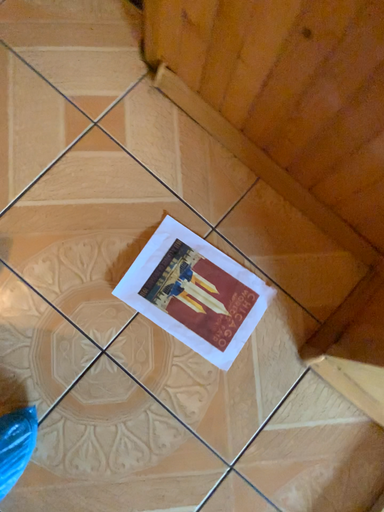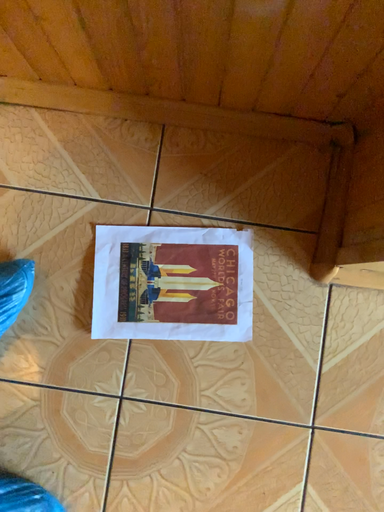
Question: How did the camera likely rotate when shooting the video?

Choices:
 (A) rotated upward
 (B) rotated downward

Answer: (B)